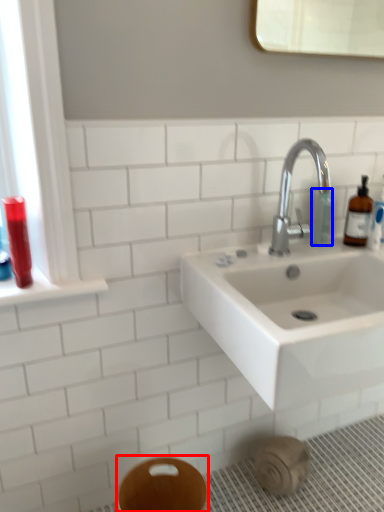
Question: Which object appears farthest to the camera in this image, bidet (highlighted by a red box) or toiletry (highlighted by a blue box)?

Choices:
 (A) bidet
 (B) toiletry

Answer: (B)